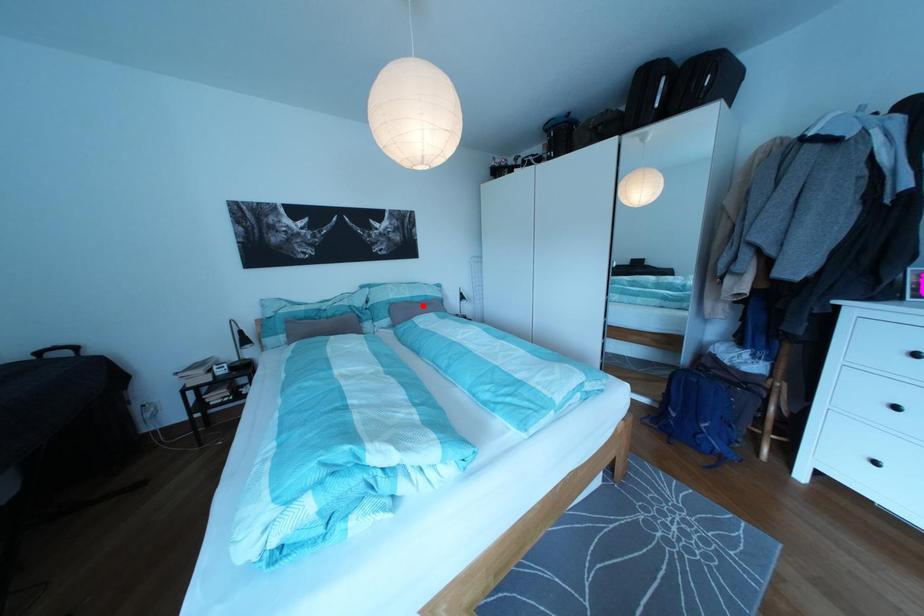
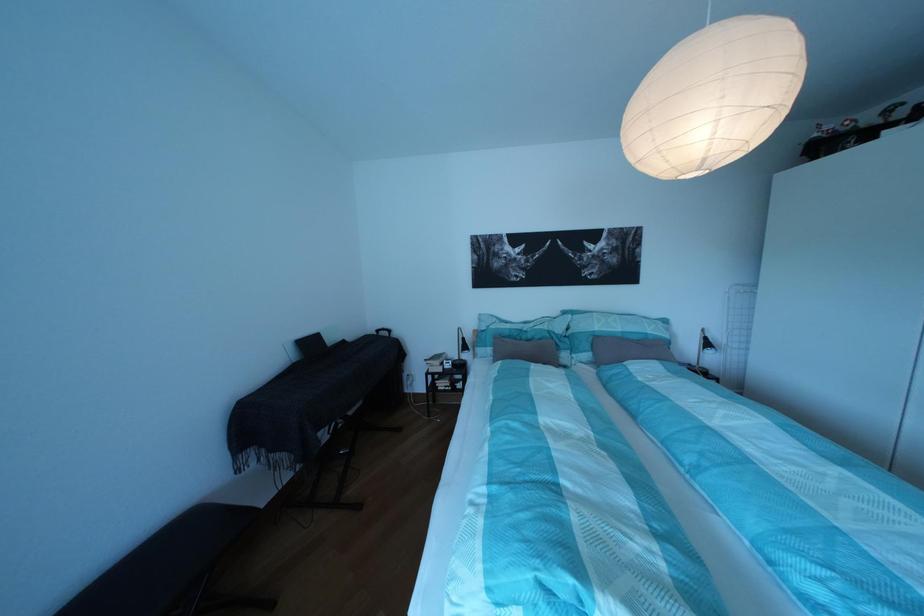
In the second image, find the point that corresponds to the highlighted location in the first image.

(633, 341)